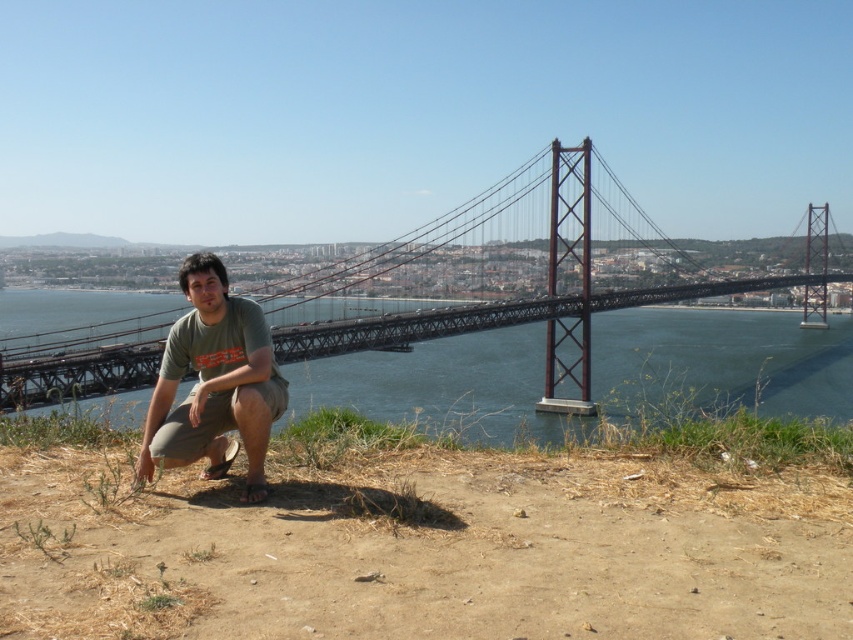
You are a photographer trying to capture the dark blue water at center in the image. Based on the scene, where should you focus your camera to ensure the water is in the frame?

The dark blue water at center is located at point (722, 360), so you should focus your camera at those coordinates to capture it properly.